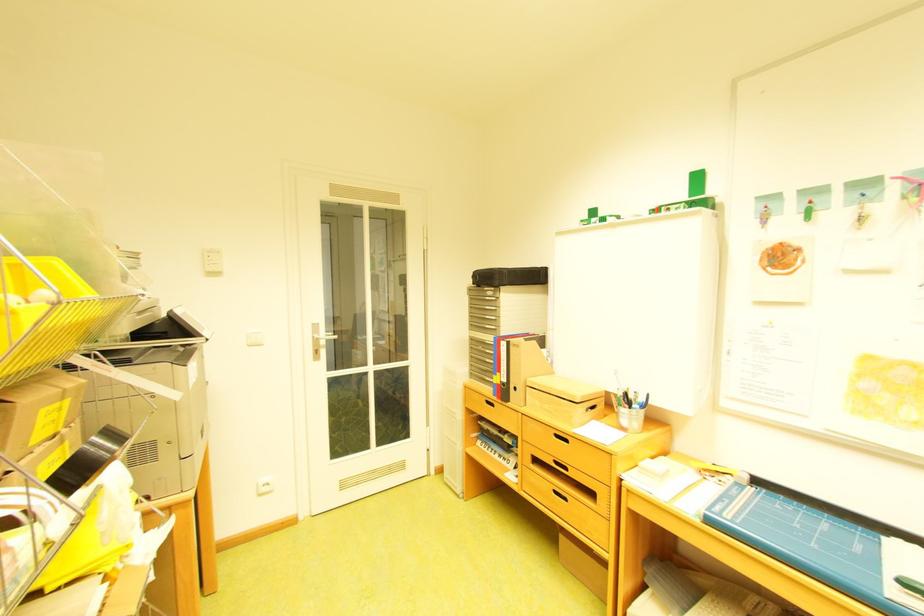
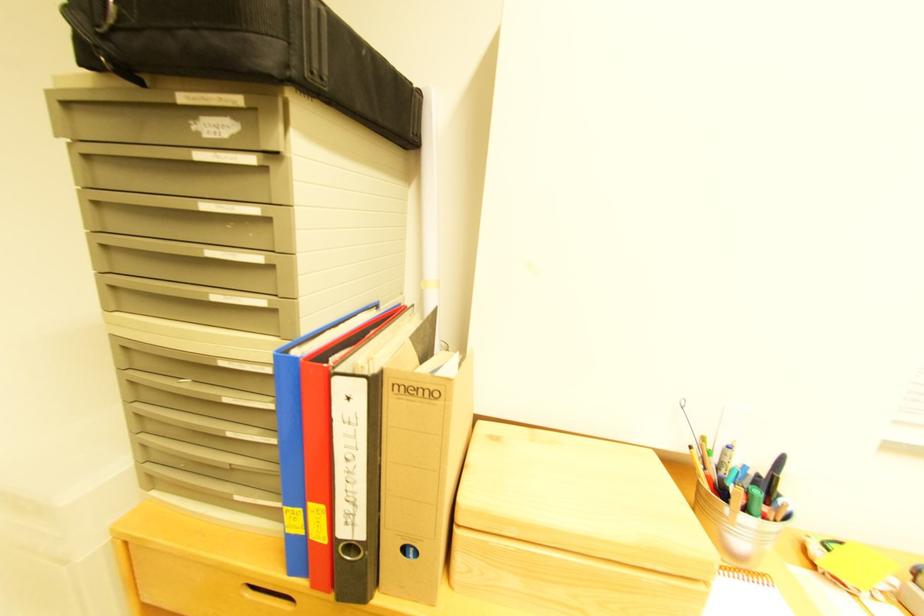
Where in the second image is the point corresponding to [516,382] from the first image?

(371, 536)